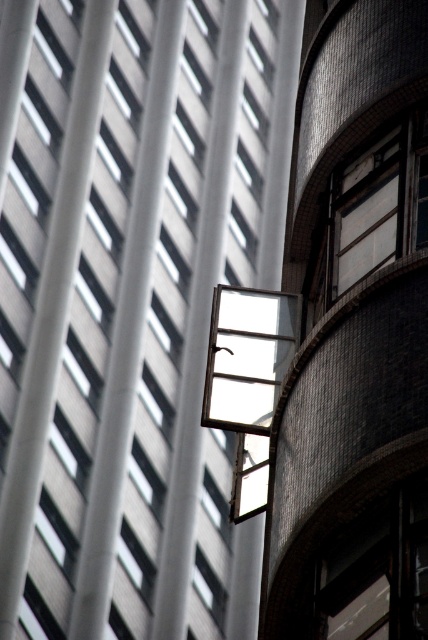
You are an architect analyzing the building layout. You see the transparent glass window at center and the metallic glass window at upper right. Which window is positioned to the right side of the other?

The transparent glass window at center is to the left of metallic glass window at upper right, so the metallic glass window at upper right is positioned to the right side of the transparent glass window at center.

You are an architect analyzing the building layout. Which object is positioned higher in the image, the transparent glass window at center or the metallic glass window at upper right?

The transparent glass window at center is located above the metallic glass window at upper right, so it is positioned higher in the image.

You are an architect designing a new building and want to ensure proper spacing between windows. Given the transparent glass window at center and the metallic glass window at upper right, which window requires more horizontal space to accommodate its design?

The transparent glass window at center requires more horizontal space because its width is larger than the metallic glass window at upper right.